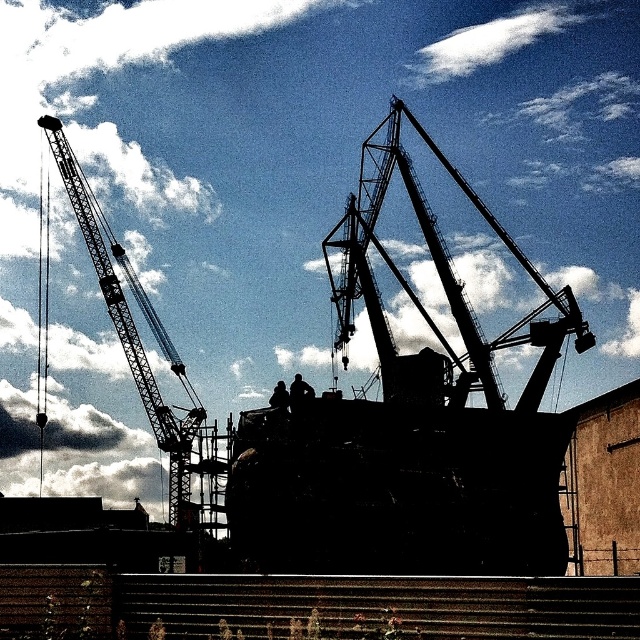
Question: Is black matte boat at center to the right of silhouette metal crane at center from the viewer's perspective?

Choices:
 (A) yes
 (B) no

Answer: (B)

Question: Does black matte boat at center lie in front of silhouette metal crane at center?

Choices:
 (A) yes
 (B) no

Answer: (A)

Question: Considering the real-world distances, which object is closest to the silhouette metal crane at center?

Choices:
 (A) silhouette metal crane at left
 (B) black matte boat at center

Answer: (B)

Question: Which of these objects is positioned farthest from the silhouette metal crane at center?

Choices:
 (A) silhouette metal crane at left
 (B) black matte boat at center

Answer: (A)

Question: Considering the real-world distances, which object is closest to the silhouette metal crane at left?

Choices:
 (A) black matte boat at center
 (B) silhouette metal crane at center

Answer: (A)

Question: Is silhouette metal crane at center wider than silhouette metal crane at left?

Choices:
 (A) yes
 (B) no

Answer: (A)